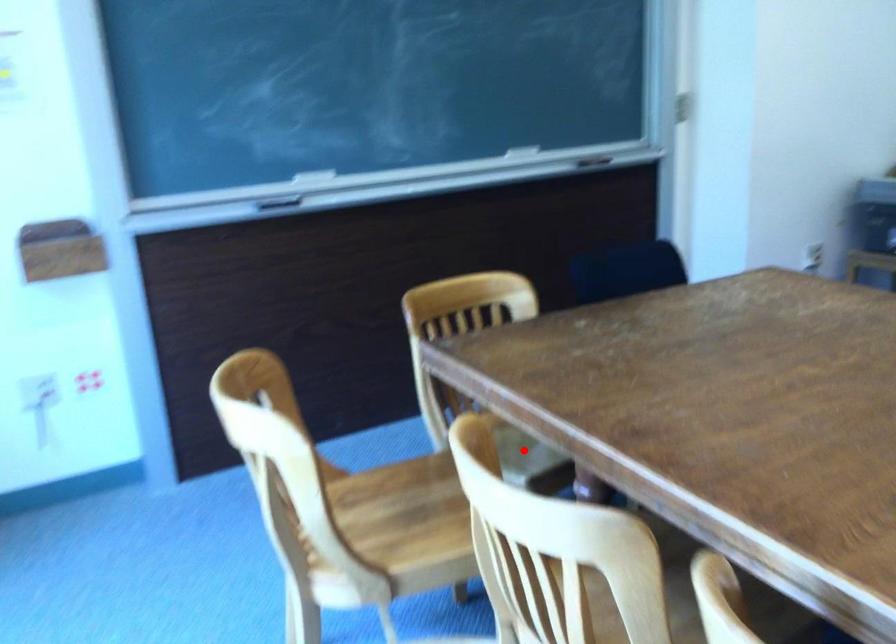
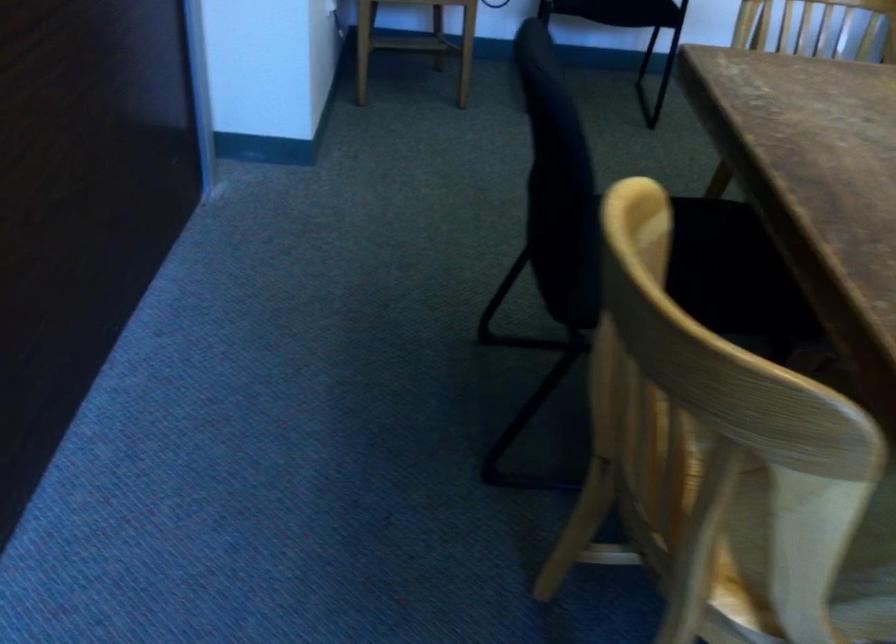
Question: I am providing you with two images of the same scene from different viewpoints. Given a red point in image1, look at the same physical point in image2. Is it:

Choices:
 (A) Closer to the viewpoint
 (B) Farther from the viewpoint

Answer: (A)